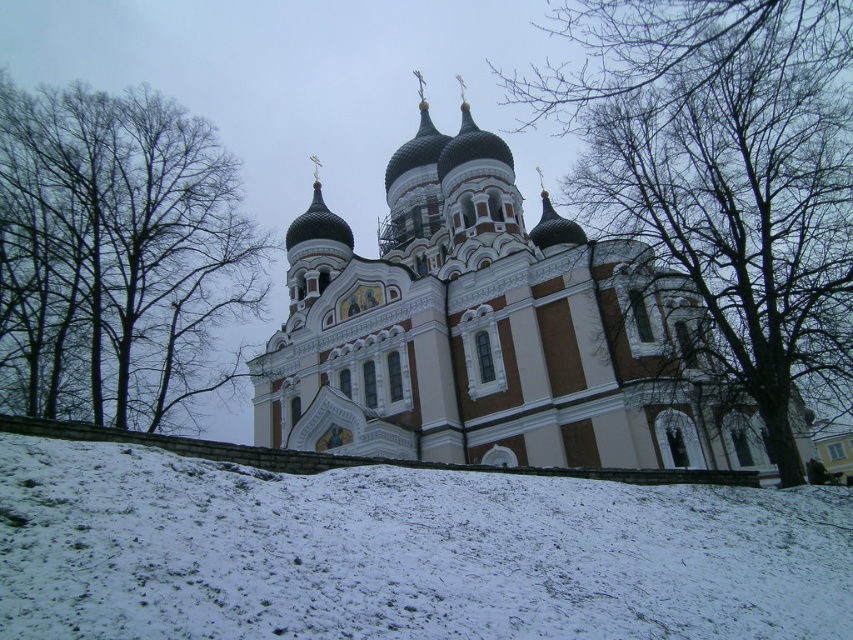
You are standing in the snow in front of the white stone church at center and want to take a photo of the brown bark tree at upper left. In which direction should you move relative to the church to get the tree in your camera frame?

You should move to the left of the white stone church at center to capture the brown bark tree at upper left in your photo, as the brown bark tree at upper left is located to the left of the white stone church at center.

From the picture: You are standing at the bottom of the incline looking up at the church. Which object, the white powdery snow at lower center or the white stone church at center, appears narrower from your vantage point?

The white powdery snow at lower center appears narrower because it has a lesser width compared to the white stone church at center.

You are standing at the bottom of the incline looking up at the white stone church at center and the brown bark tree at upper left. Which object appears taller in the scene?

The white stone church at center appears taller than the brown bark tree at upper left.